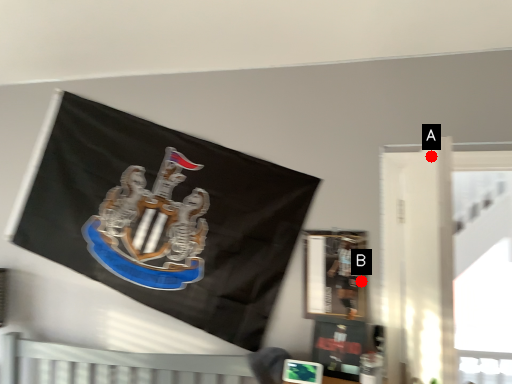
Question: Two points are circled on the image, labeled by A and B beside each circle. Which point appears farthest from the camera in this image?

Choices:
 (A) A is further
 (B) B is further

Answer: (B)